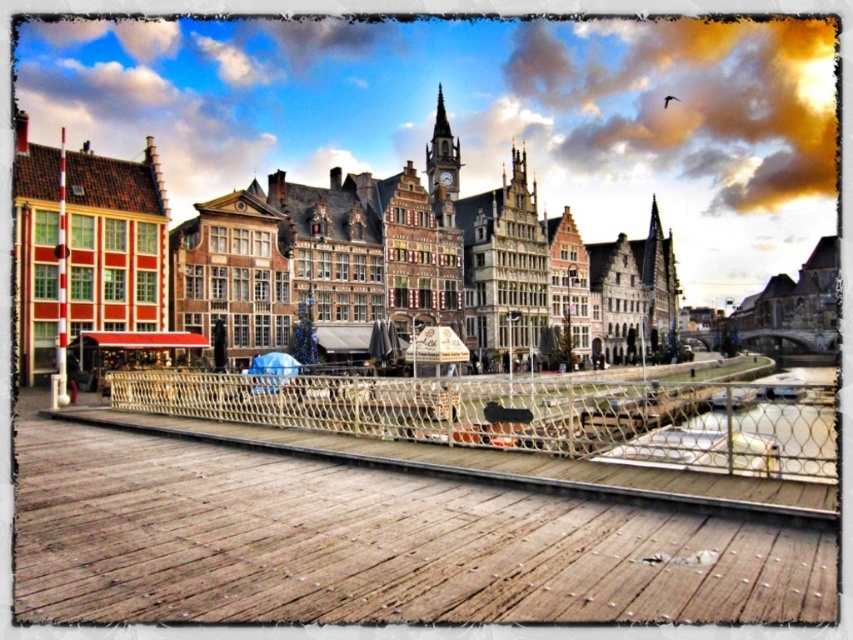
Question: Can you confirm if weathered wood dock at lower center is thinner than metallic mesh rail at center?

Choices:
 (A) no
 (B) yes

Answer: (B)

Question: Does weathered wood dock at lower center appear over metallic mesh rail at center?

Choices:
 (A) no
 (B) yes

Answer: (A)

Question: Which of the following is the closest to the observer?

Choices:
 (A) (229, 515)
 (B) (416, 388)

Answer: (A)

Question: Which of the following is the closest to the observer?

Choices:
 (A) (467, 380)
 (B) (712, 532)

Answer: (B)

Question: Is weathered wood dock at lower center closer to camera compared to metallic mesh rail at center?

Choices:
 (A) yes
 (B) no

Answer: (A)

Question: Which of the following is the farthest from the observer?

Choices:
 (A) (41, 548)
 (B) (645, 422)

Answer: (B)